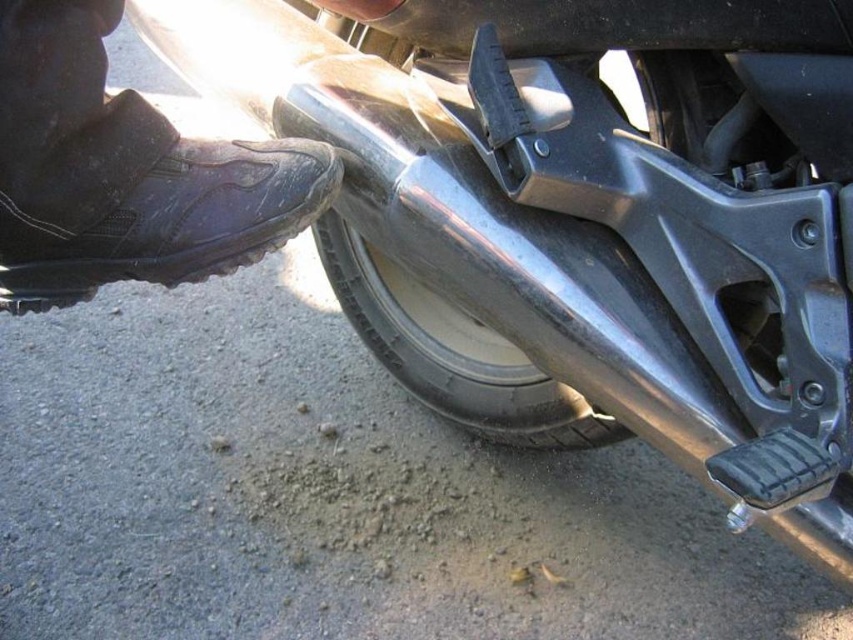
You are a mechanic inspecting the motorcycle. You need to access the exhaust pipe located behind the shiny metallic tire at lower center. However, there is a black leather boot at lower left blocking your view. Which object should you move first to get a clear view of the exhaust pipe?

You should move the black leather boot at lower left first because it is positioned to the left of the shiny metallic tire at lower center and is blocking the view of the exhaust pipe.

You are a mechanic inspecting a motorcycle parked on a gravelly surface. You notice the black leather boot at lower left and the shiny metallic tire at lower center. Which object is positioned higher from the ground?

The black leather boot at lower left is located above the shiny metallic tire at lower center, so it is positioned higher from the ground.

Based on the photo, you are standing 80.38 centimeters away from the point labeled as point (132,218). Can you reach it without moving your feet?

Yes, because the distance between you and point (132,218) is exactly 80.38 centimeters, which is within typical human arm reach.